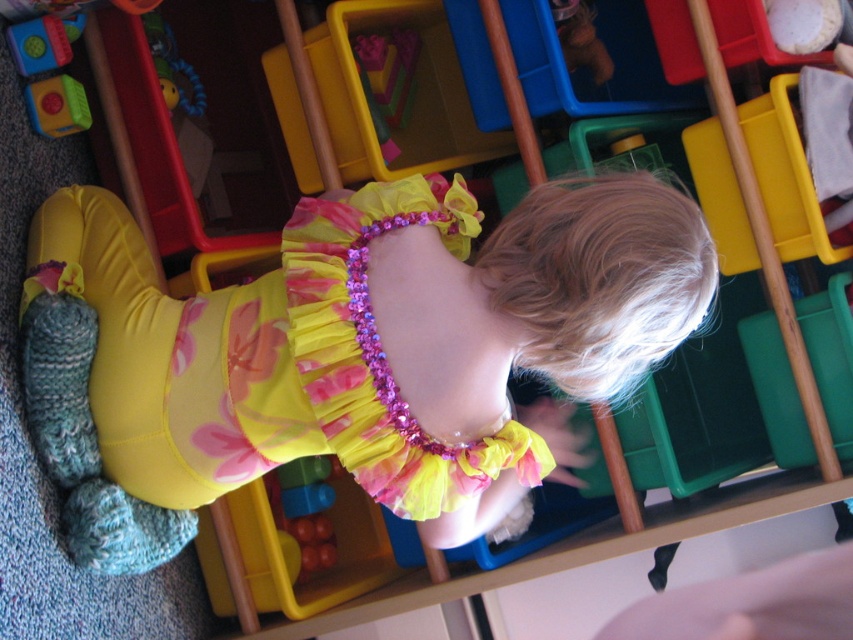
You are a parent trying to pack a bag for a child. You have a yellow satin dress at center and a rubberized green toy at upper left. Which item should you place first into the bag if you want to place the taller item on top?

The yellow satin dress at center is taller than the rubberized green toy at upper left, so you should place the yellow satin dress at center first into the bag to have it on top.